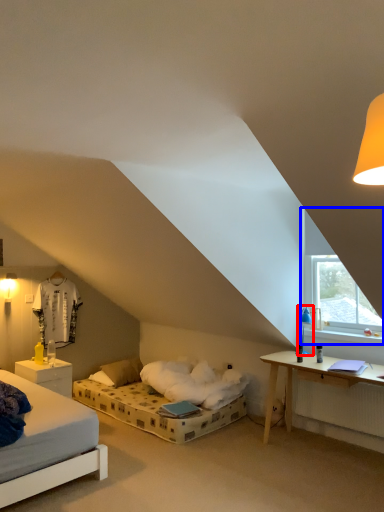
Question: Which object appears closest to the camera in this image, table lamp (highlighted by a red box) or window (highlighted by a blue box)?

Choices:
 (A) table lamp
 (B) window

Answer: (B)